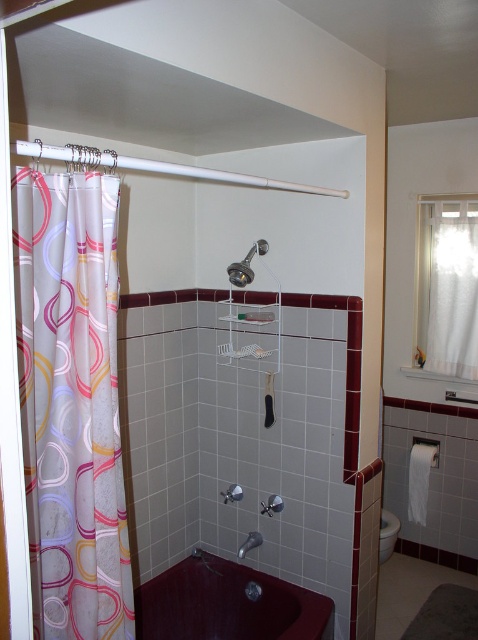
Which is in front, point (193, 637) or point (239, 266)?

Point (239, 266)

Is point (315, 627) positioned behind point (253, 275)?

No, it is in front of (253, 275).

This screenshot has width=478, height=640. In order to click on maroon glossy bathtub at lower center in this screenshot , I will do `click(228, 604)`.

What do you see at coordinates (10, 397) in the screenshot?
I see `white plastic shower curtain at left` at bounding box center [10, 397].

Between white plastic shower curtain at left and white sheer curtain at upper right, which one appears on the right side from the viewer's perspective?

white sheer curtain at upper right is more to the right.

Describe the element at coordinates (10, 397) in the screenshot. This screenshot has width=478, height=640. I see `white plastic shower curtain at left` at that location.

Where is `white plastic shower curtain at left`? white plastic shower curtain at left is located at coordinates (10, 397).

Can you confirm if maroon glossy bathtub at lower center is shorter than white sheer curtain at upper right?

Yes.

What do you see at coordinates (228, 604) in the screenshot?
I see `maroon glossy bathtub at lower center` at bounding box center [228, 604].

Where is `maroon glossy bathtub at lower center`? maroon glossy bathtub at lower center is located at coordinates (228, 604).